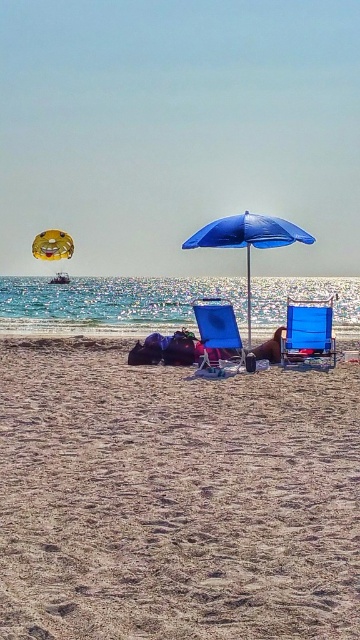
Question: Which object is closer to the camera taking this photo?

Choices:
 (A) blue fabric beach chair at center
 (B) blue fabric umbrella at center

Answer: (B)

Question: Does blue fabric beach chair at center appear on the left side of blue fabric chair at center?

Choices:
 (A) no
 (B) yes

Answer: (A)

Question: Which point is closer to the camera?

Choices:
 (A) (227, 326)
 (B) (285, 340)
 (C) (42, 388)

Answer: (C)

Question: From the image, what is the correct spatial relationship of blue fabric beach chair at center in relation to brown leather chair at center?

Choices:
 (A) left
 (B) right

Answer: (B)

Question: Can you confirm if blue fabric umbrella at center is positioned above brown leather chair at center?

Choices:
 (A) no
 (B) yes

Answer: (B)

Question: Which object appears closest to the camera in this image?

Choices:
 (A) brown leather chair at center
 (B) brown sandy beach at center

Answer: (B)